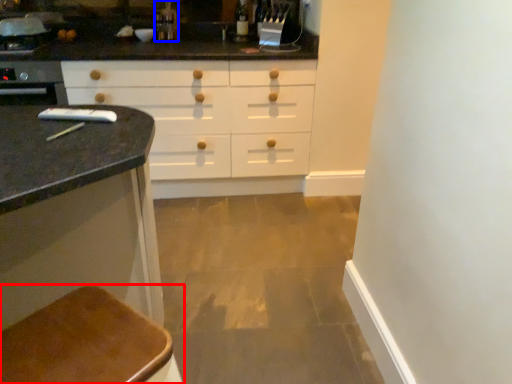
Question: Which point is closer to the camera, furniture (highlighted by a red box) or faucet (highlighted by a blue box)?

Choices:
 (A) furniture
 (B) faucet

Answer: (A)